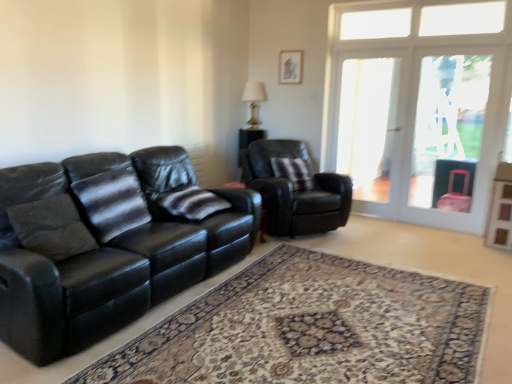
Measure the distance between point (373, 100) and camera.

Point (373, 100) is 5.77 meters from camera.

Image resolution: width=512 pixels, height=384 pixels. Describe the element at coordinates (290, 66) in the screenshot. I see `matte white picture frame at upper center` at that location.

Locate an element on the screen. striped fabric pillow at left, placed as the first pillow when sorted from front to back is located at coordinates (112, 202).

This screenshot has width=512, height=384. Describe the element at coordinates (254, 102) in the screenshot. I see `matte glass lamp at upper center` at that location.

What do you see at coordinates (295, 191) in the screenshot? I see `black leather armchair at center` at bounding box center [295, 191].

Measure the distance between clear glass screen door at right, acting as the 2th screen door starting from the left, and camera.

They are 4.61 meters apart.

At what (x,y) coordinates should I click in order to perform the action: click on transparent glass screen door at right, which appears as the 2th screen door when viewed from the right. Please return your answer as a coordinate pair (x, y). Looking at the image, I should click on (368, 126).

Considering the sizes of transparent glass screen door at right, which appears as the 2th screen door when viewed from the right, and carpeted rug at center in the image, is transparent glass screen door at right, which appears as the 2th screen door when viewed from the right, bigger or smaller than carpeted rug at center?

Clearly, transparent glass screen door at right, which appears as the 2th screen door when viewed from the right, is smaller in size than carpeted rug at center.

Is the surface of transparent glass screen door at right, the 1th screen door positioned from the left, in direct contact with carpeted rug at center?

There is a gap between transparent glass screen door at right, the 1th screen door positioned from the left, and carpeted rug at center.

In terms of width, does transparent glass screen door at right, the 1th screen door positioned from the left, look wider or thinner when compared to carpeted rug at center?

Clearly, transparent glass screen door at right, the 1th screen door positioned from the left, has less width compared to carpeted rug at center.

Is striped fabric pillow at left, placed as the first pillow when sorted from front to back, taller than matte glass lamp at upper center?

Yes.

The image size is (512, 384). Identify the location of lamp above the striped fabric pillow at left, placed as the first pillow when sorted from front to back (from a real-world perspective). (254, 102).

From the picture: Between striped fabric pillow at left, the first pillow from the left, and matte glass lamp at upper center, which one has larger width?

striped fabric pillow at left, the first pillow from the left, is wider.

Considering the sizes of objects black leather armchair at center and striped fabric pillow at left, placed as the first pillow when sorted from front to back, in the image provided, who is taller, black leather armchair at center or striped fabric pillow at left, placed as the first pillow when sorted from front to back,?

black leather armchair at center.

How distant is black leather armchair at center from striped fabric pillow at left, the first pillow from the left?

A distance of 5.61 feet exists between black leather armchair at center and striped fabric pillow at left, the first pillow from the left.

Is black leather armchair at center bigger than striped fabric pillow at left, the 3th pillow when ordered from back to front?

Yes.

From the image's perspective, is black leather armchair at center over striped fabric pillow at left, the 3th pillow when ordered from back to front?

Yes, from the image's perspective, black leather armchair at center is over striped fabric pillow at left, the 3th pillow when ordered from back to front.

Image resolution: width=512 pixels, height=384 pixels. I want to click on door on the right side of transparent glass screen door at right, which appears as the 2th screen door when viewed from the right, so click(420, 104).

Would you say white glass door at upper right is part of transparent glass screen door at right, which appears as the 2th screen door when viewed from the right,'s contents?

No, white glass door at upper right is not a part of transparent glass screen door at right, which appears as the 2th screen door when viewed from the right.

Considering the relative positions of transparent glass screen door at right, which appears as the 2th screen door when viewed from the right, and white glass door at upper right in the image provided, is transparent glass screen door at right, which appears as the 2th screen door when viewed from the right, to the left of white glass door at upper right from the viewer's perspective?

Yes.

Which of these two, transparent glass screen door at right, which appears as the 2th screen door when viewed from the right, or white glass door at upper right, is smaller?

With smaller size is transparent glass screen door at right, which appears as the 2th screen door when viewed from the right.

Does white glass door at upper right have a lesser width compared to black leather armchair at center?

Yes, white glass door at upper right is thinner than black leather armchair at center.

Image resolution: width=512 pixels, height=384 pixels. Identify the location of door that appears above the black leather armchair at center (from the image's perspective). (420, 104).

From the image's perspective, which object appears higher, white glass door at upper right or black leather armchair at center?

From the image's view, white glass door at upper right is above.

Does black leather armchair at center have a greater height compared to white glass door at upper right?

Incorrect, the height of black leather armchair at center is not larger of that of white glass door at upper right.

Relative to white glass door at upper right, is black leather armchair at center in front or behind?

Visually, black leather armchair at center is located in front of white glass door at upper right.

Is black leather armchair at center inside the boundaries of white glass door at upper right, or outside?

black leather armchair at center is outside white glass door at upper right.

Looking at this image, does black leather armchair at center touch white glass door at upper right?

black leather armchair at center and white glass door at upper right are clearly separated.

From a real-world perspective, is striped fabric pillow at center, the 2th pillow viewed from the left, physically located above or below carpeted rug at center?

striped fabric pillow at center, the 2th pillow viewed from the left, is situated higher than carpeted rug at center in the real world.

Which object is wider, striped fabric pillow at center, the 2th pillow viewed from the left, or carpeted rug at center?

Wider between the two is carpeted rug at center.

Locate an element on the screen. the 1st pillow positioned above the carpeted rug at center (from a real-world perspective) is located at coordinates click(x=192, y=203).

How much distance is there between striped fabric pillow at center, placed as the second pillow when sorted from front to back, and carpeted rug at center?

The distance of striped fabric pillow at center, placed as the second pillow when sorted from front to back, from carpeted rug at center is 1.16 meters.

The height and width of the screenshot is (384, 512). Identify the location of plain on the left of transparent glass screen door at right, which appears as the 2th screen door when viewed from the right. (310, 328).

Find the location of `lamp that is on the right side of striped fabric pillow at left, the 3th pillow when ordered from back to front`. lamp that is on the right side of striped fabric pillow at left, the 3th pillow when ordered from back to front is located at coordinates (254, 102).

From the image, which object appears to be farther from black leather armchair at center, transparent glass screen door at right, the 1th screen door positioned from the left, or black leather couch at left?

Among the two, transparent glass screen door at right, the 1th screen door positioned from the left, is located further to black leather armchair at center.

Looking at the image, which one is located closer to black leather couch at left, black leather armchair at center or striped fabric pillow at center, which appears as the 1th pillow when viewed from the back?

Among the two, black leather armchair at center is located nearer to black leather couch at left.

Which object lies nearer to the anchor point carpeted rug at center, striped fabric pillow at left, the first pillow from the left, or matte glass lamp at upper center?

Among the two, striped fabric pillow at left, the first pillow from the left, is located nearer to carpeted rug at center.

Based on the photo, when comparing their distances from matte glass lamp at upper center, does transparent glass screen door at right, which appears as the 2th screen door when viewed from the right, or striped fabric pillow at left, the 3th pillow when ordered from back to front, seem closer?

transparent glass screen door at right, which appears as the 2th screen door when viewed from the right, is positioned closer to the anchor matte glass lamp at upper center.

Consider the image. Which object lies further to the anchor point striped fabric pillow at center, the 2th pillow positioned from the back, white glass door at upper right or transparent glass screen door at right, which appears as the 2th screen door when viewed from the right?

white glass door at upper right.

Based on the photo, looking at the image, which one is located closer to striped fabric pillow at left, the first pillow from the left, striped fabric pillow at center, which is the 2th pillow in right-to-left order, or clear glass screen door at right, acting as the 2th screen door starting from the left?

The object closer to striped fabric pillow at left, the first pillow from the left, is striped fabric pillow at center, which is the 2th pillow in right-to-left order.

Considering their positions, is white glass door at upper right positioned further to black leather armchair at center than matte white picture frame at upper center?

matte white picture frame at upper center.

Based on their spatial positions, is black leather couch at left or matte glass lamp at upper center further from clear glass screen door at right, which appears as the 1th screen door when viewed from the right?

black leather couch at left lies further to clear glass screen door at right, which appears as the 1th screen door when viewed from the right, than the other object.

The image size is (512, 384). I want to click on chair between carpeted rug at center and white glass door at upper right from front to back, so click(x=295, y=191).

Find the location of a particular element. Image resolution: width=512 pixels, height=384 pixels. pillow between striped fabric pillow at center, the 2th pillow viewed from the left, and white glass door at upper right is located at coordinates (294, 172).

Where is `studio couch between carpeted rug at center and transparent glass screen door at right, which appears as the 2th screen door when viewed from the right, in the front-back direction`? studio couch between carpeted rug at center and transparent glass screen door at right, which appears as the 2th screen door when viewed from the right, in the front-back direction is located at coordinates 104,246.

I want to click on chair between matte white picture frame at upper center and clear glass screen door at right, which appears as the 1th screen door when viewed from the right, in the horizontal direction, so click(295, 191).